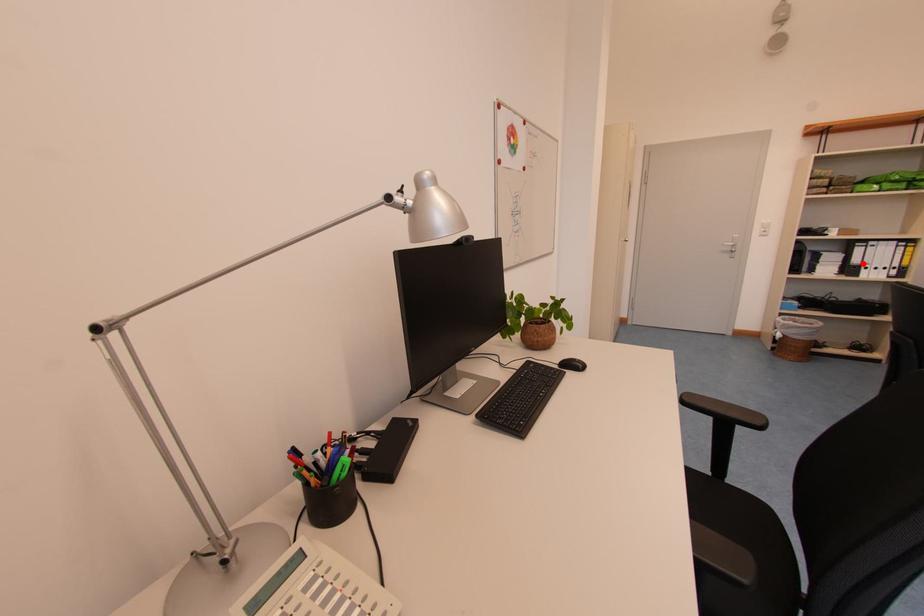
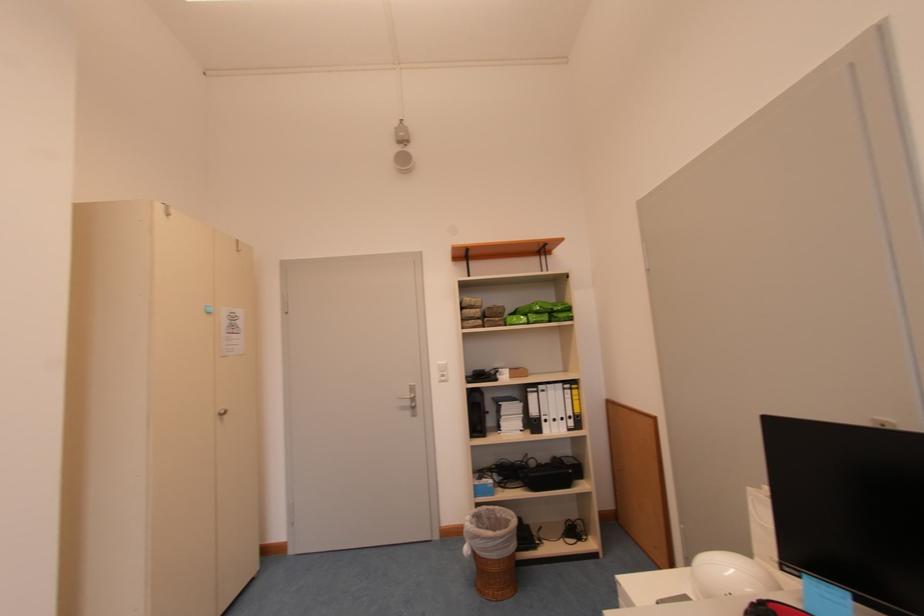
In the second image, find the point that corresponds to the highlighted location in the first image.

(541, 415)